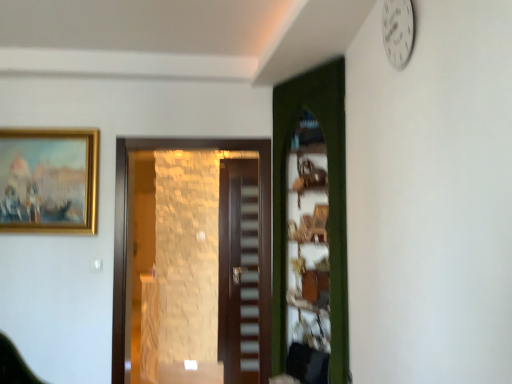
Question: From the image's perspective, is brown wooden door at center, which is the second door in left-to-right order, located above or below dark wood stairwell at center?

Choices:
 (A) above
 (B) below

Answer: (B)

Question: Which is correct: brown wooden door at center, arranged as the 1th door when viewed from the back, is inside dark wood stairwell at center, or outside of it?

Choices:
 (A) inside
 (B) outside

Answer: (B)

Question: Which of these objects is positioned farthest from the white plastic clock at upper right?

Choices:
 (A) green wooden door at center, arranged as the 3th door when viewed from the left
 (B) brown stone wall at center, the third door positioned from the right
 (C) dark wood stairwell at center
 (D) gold-framed painting at upper left
 (E) brown wooden door at center, which is the 2th door in right-to-left order

Answer: (E)

Question: Which of these objects is positioned farthest from the gold-framed painting at upper left?

Choices:
 (A) green wooden door at center, arranged as the 3th door when viewed from the left
 (B) dark wood stairwell at center
 (C) brown wooden door at center, which is the 3th door in front-to-back order
 (D) brown stone wall at center, the 1th door when ordered from left to right
 (E) white plastic clock at upper right

Answer: (E)